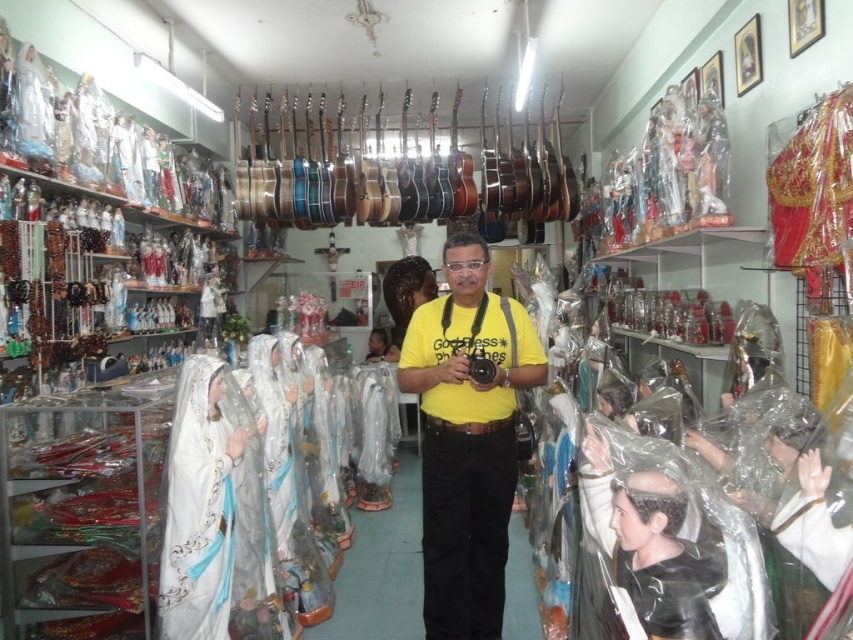
Who is higher up, yellow cotton t-shirt at center or white glossy statue at center?

yellow cotton t-shirt at center is higher up.

Based on the photo, is yellow cotton t-shirt at center wider than white glossy statue at center?

Correct, the width of yellow cotton t-shirt at center exceeds that of white glossy statue at center.

Who is more forward, (427,547) or (165,520)?

Point (165,520) is in front.

You are a GUI agent. You are given a task and a screenshot of the screen. Output one action in this format:
    pyautogui.click(x=<x>, y=<y>)
    Task: Click on the yellow cotton t-shirt at center
    Image resolution: width=853 pixels, height=640 pixels.
    Given the screenshot: What is the action you would take?
    point(467,438)